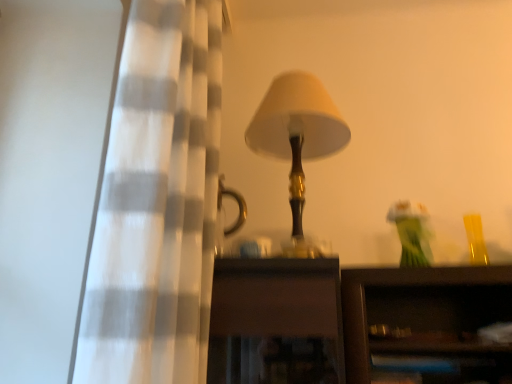
The height and width of the screenshot is (384, 512). Describe the element at coordinates (297, 138) in the screenshot. I see `matte gold lamp at center` at that location.

Describe the element at coordinates (152, 191) in the screenshot. I see `white checkered curtain at left` at that location.

What do you see at coordinates (412, 233) in the screenshot?
I see `translucent glass vase at upper right` at bounding box center [412, 233].

Identify the location of matte gold lamp at center. (297, 138).

Considering their positions, is translucent glass vase at upper right located in front of or behind white checkered curtain at left?

In the image, translucent glass vase at upper right appears behind white checkered curtain at left.

Between translucent glass vase at upper right and white checkered curtain at left, which one appears on the left side from the viewer's perspective?

Positioned to the left is white checkered curtain at left.

In the scene shown: Could white checkered curtain at left be considered to be inside translucent glass vase at upper right?

Actually, white checkered curtain at left is outside translucent glass vase at upper right.

How much distance is there between translucent glass vase at upper right and white checkered curtain at left?

The distance of translucent glass vase at upper right from white checkered curtain at left is 26.27 inches.

Does white checkered curtain at left have a smaller size compared to translucent glass vase at upper right?

No.

Considering the relative positions of white checkered curtain at left and translucent glass vase at upper right in the image provided, is white checkered curtain at left to the left of translucent glass vase at upper right from the viewer's perspective?

Correct, you'll find white checkered curtain at left to the left of translucent glass vase at upper right.

I want to click on toy behind the white checkered curtain at left, so click(x=412, y=233).

Is there a large distance between matte gold lamp at center and translucent glass vase at upper right?

No, matte gold lamp at center is not far away from translucent glass vase at upper right.

Is the position of matte gold lamp at center more distant than that of translucent glass vase at upper right?

No, matte gold lamp at center is closer to the viewer.

From the image's perspective, who appears lower, matte gold lamp at center or translucent glass vase at upper right?

translucent glass vase at upper right, from the image's perspective.

Is matte gold lamp at center bigger or smaller than translucent glass vase at upper right?

Considering their sizes, matte gold lamp at center takes up more space than translucent glass vase at upper right.

Relative to matte gold lamp at center, is white checkered curtain at left in front or behind?

Clearly, white checkered curtain at left is in front of matte gold lamp at center.

Is white checkered curtain at left oriented towards matte gold lamp at center?

Yes, white checkered curtain at left is turned towards matte gold lamp at center.

Considering the sizes of objects white checkered curtain at left and matte gold lamp at center in the image provided, who is taller, white checkered curtain at left or matte gold lamp at center?

Standing taller between the two is white checkered curtain at left.

The height and width of the screenshot is (384, 512). Find the location of `lamp on the right of white checkered curtain at left`. lamp on the right of white checkered curtain at left is located at coordinates (297, 138).

Does point (296, 138) come closer to viewer compared to point (219, 95)?

Yes.

Is the surface of matte gold lamp at center in direct contact with white checkered curtain at left?

No, matte gold lamp at center is not in contact with white checkered curtain at left.

Would you say white checkered curtain at left is part of matte gold lamp at center's contents?

No, white checkered curtain at left is not surrounded by matte gold lamp at center.

Which point is more distant from viewer, (x=423, y=240) or (x=288, y=134)?

Point (x=288, y=134)

Image resolution: width=512 pixels, height=384 pixels. I want to click on toy beneath the matte gold lamp at center (from a real-world perspective), so click(412, 233).

Does translucent glass vase at upper right appear on the right side of matte gold lamp at center?

Indeed, translucent glass vase at upper right is positioned on the right side of matte gold lamp at center.

Are translucent glass vase at upper right and matte gold lamp at center located far from each other?

translucent glass vase at upper right is actually quite close to matte gold lamp at center.

This screenshot has width=512, height=384. In order to click on curtain that is in front of the translucent glass vase at upper right in this screenshot , I will do `click(152, 191)`.

What are the coordinates of `toy below the white checkered curtain at left (from the image's perspective)` in the screenshot? It's located at (412, 233).

Which object lies further to the anchor point white checkered curtain at left, translucent glass vase at upper right or matte gold lamp at center?

translucent glass vase at upper right is positioned further to the anchor white checkered curtain at left.

From the image, which object appears to be farther from matte gold lamp at center, translucent glass vase at upper right or white checkered curtain at left?

The object further to matte gold lamp at center is translucent glass vase at upper right.

Estimate the real-world distances between objects in this image. Which object is closer to matte gold lamp at center, white checkered curtain at left or translucent glass vase at upper right?

white checkered curtain at left lies closer to matte gold lamp at center than the other object.

Which object lies further to the anchor point translucent glass vase at upper right, matte gold lamp at center or white checkered curtain at left?

The object further to translucent glass vase at upper right is white checkered curtain at left.

When comparing their distances from translucent glass vase at upper right, does white checkered curtain at left or matte gold lamp at center seem further?

white checkered curtain at left lies further to translucent glass vase at upper right than the other object.

When comparing their distances from white checkered curtain at left, does matte gold lamp at center or translucent glass vase at upper right seem further?

translucent glass vase at upper right.

Image resolution: width=512 pixels, height=384 pixels. Find the location of `lamp between white checkered curtain at left and translucent glass vase at upper right from front to back`. lamp between white checkered curtain at left and translucent glass vase at upper right from front to back is located at coordinates (297, 138).